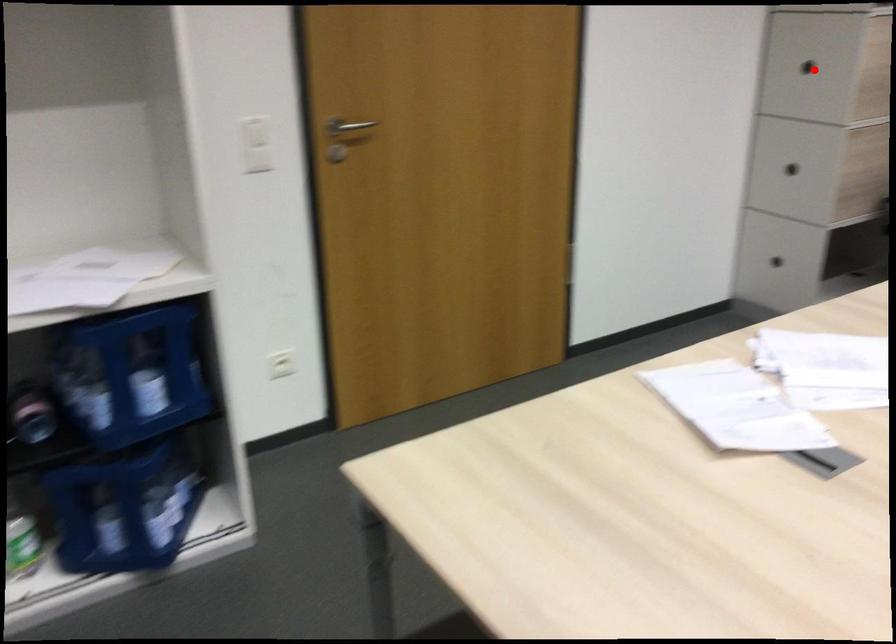
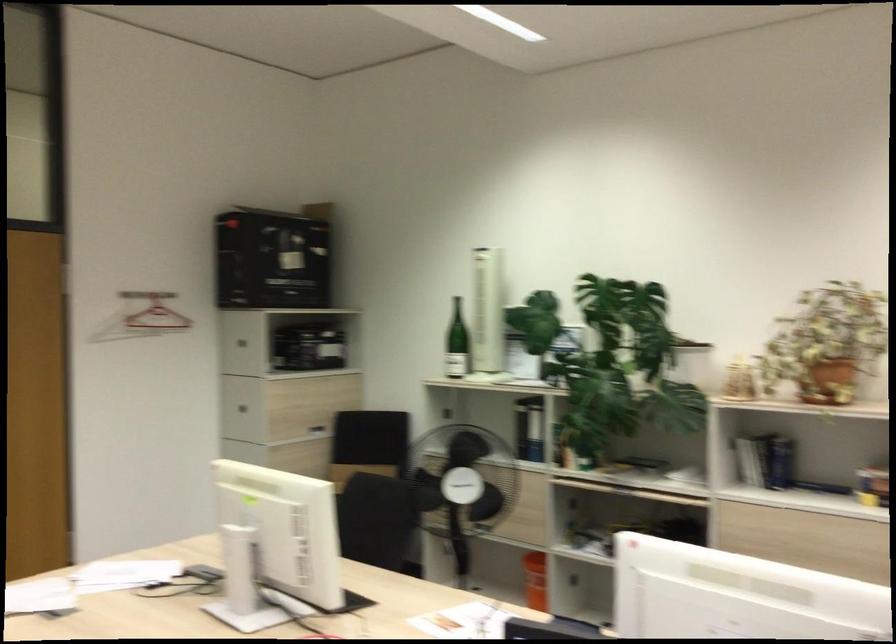
Question: I am providing you with two images of the same scene from different viewpoints. A red point is marked on the first image. Can you still see the location of the red point in image 2?

Choices:
 (A) Yes
 (B) No

Answer: (A)